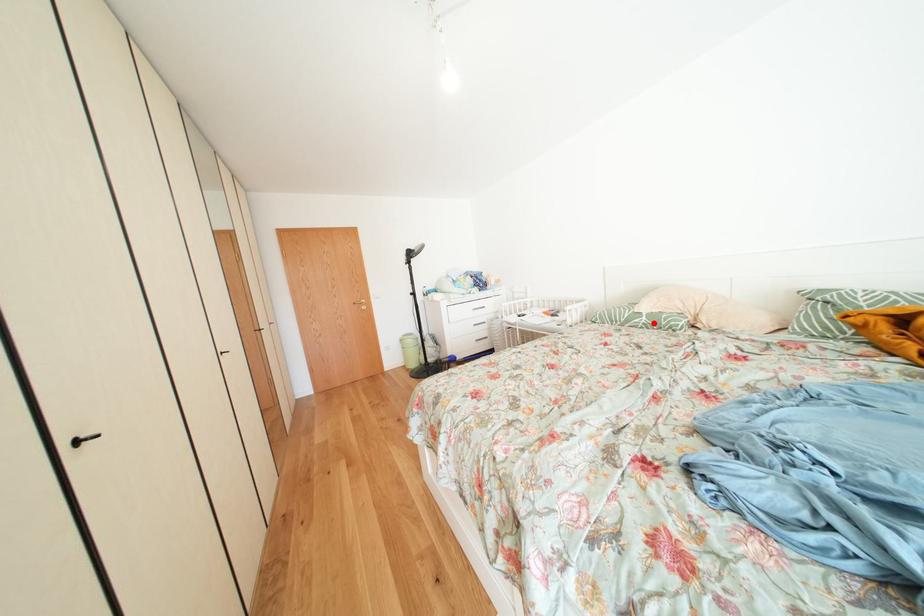
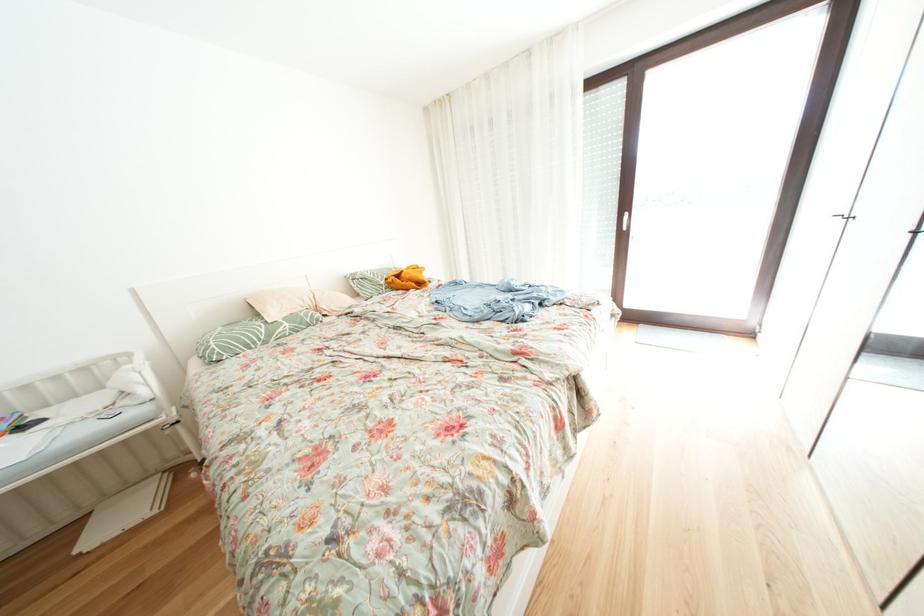
Find the pixel in the second image that matches the highlighted location in the first image.

(296, 329)